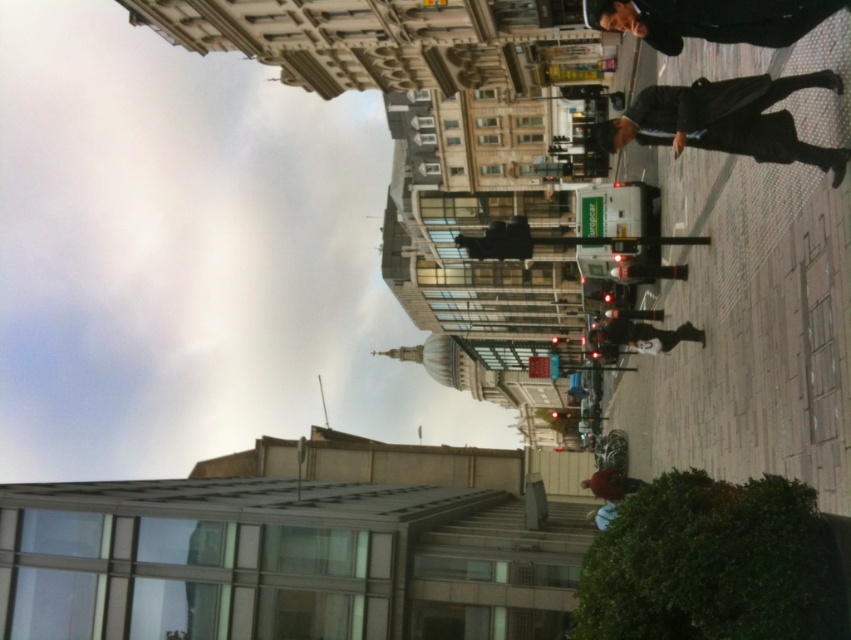
Question: Is dark blue suit at right below dark gray jacket at center?

Choices:
 (A) yes
 (B) no

Answer: (B)

Question: Does dark blue suit at right appear on the right side of dark gray jacket at center?

Choices:
 (A) no
 (B) yes

Answer: (B)

Question: Which point is farther from the camera taking this photo?

Choices:
 (A) (600, 328)
 (B) (754, 77)

Answer: (A)

Question: Is dark blue suit at right positioned in front of dark gray jacket at center?

Choices:
 (A) no
 (B) yes

Answer: (B)

Question: Among these objects, which one is nearest to the camera?

Choices:
 (A) dark blue suit at right
 (B) dark gray jacket at center

Answer: (A)

Question: Among these objects, which one is farthest from the camera?

Choices:
 (A) dark blue suit at right
 (B) dark gray jacket at center

Answer: (B)